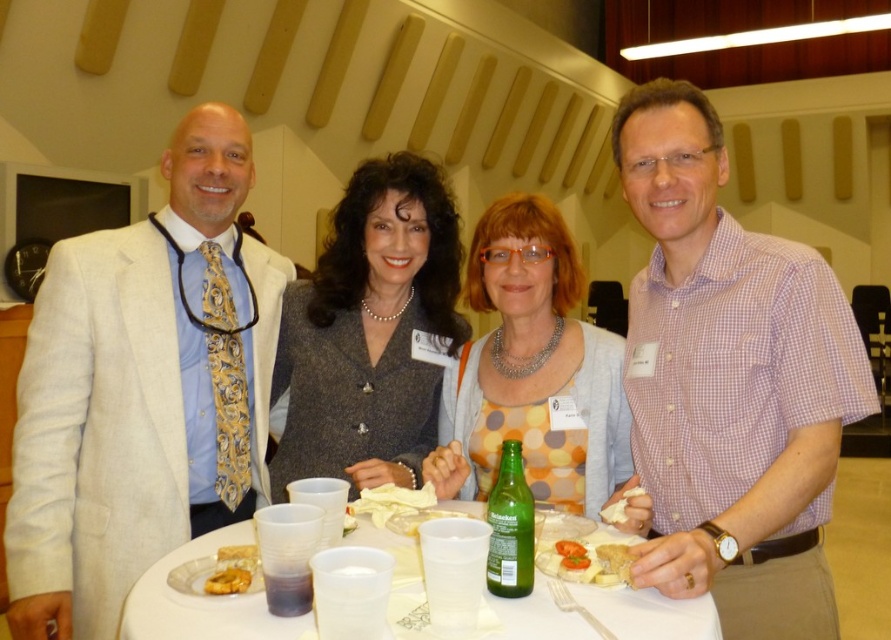
You are a photographer at the event and want to capture a photo of the pearl necklace at center and the polka dot fabric dress at center. Which object should be positioned closer to the camera to ensure both are in focus?

The pearl necklace at center is much taller than the polka dot fabric dress at center. To ensure both are in focus, position the pearl necklace at center closer to the camera since it is taller and requires more focus depth.

You are standing in front of the table where the group is seated. You need to place a small decorative item exactly at the point with coordinates point (399, 218). If your arm reaches 1.8 meters, can you comfortably place the item without moving closer?

The distance of point (399, 218) from camera is 1.87 meters. Since your arm reaches 1.8 meters, you are 0.07 meters too far to comfortably place the item without moving closer.